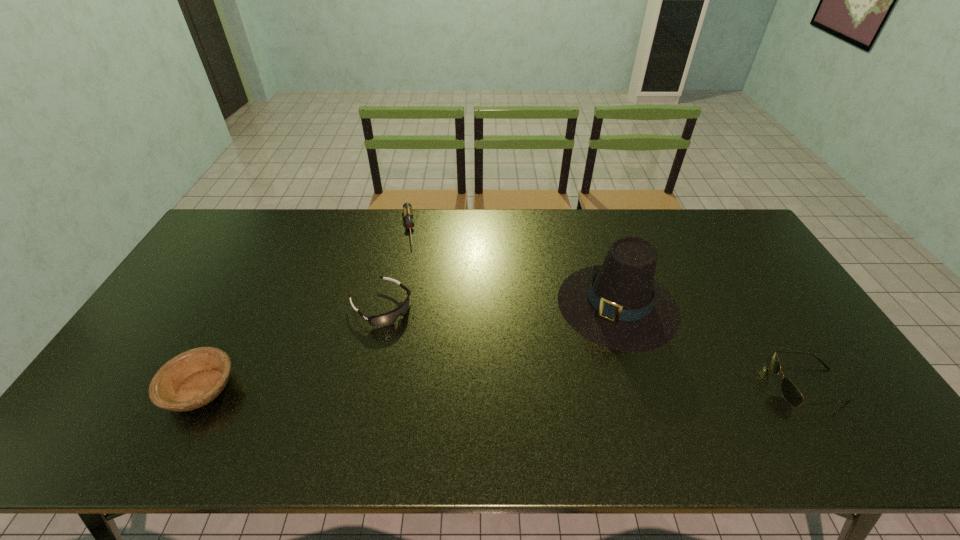
Point out which object is positioned as the nearest to the goggles. Please provide its 2D coordinates. Your answer should be formatted as a tuple, i.e. [(x, y)], where the tuple contains the x and y coordinates of a point satisfying the conditions above.

[(407, 207)]

Find the location of a particular element. object identified as the closest to the hat is located at coordinates (791, 394).

Locate an element on the screen. Image resolution: width=960 pixels, height=540 pixels. vacant space that satisfies the following two spatial constraints: 1. on the back side of the goggles; 2. on the right side of the screwdriver is located at coordinates (398, 228).

This screenshot has height=540, width=960. In order to click on free region that satisfies the following two spatial constraints: 1. on the front side of the sunglasses; 2. on the front-facing side of the tallest object in this screenshot , I will do `click(643, 385)`.